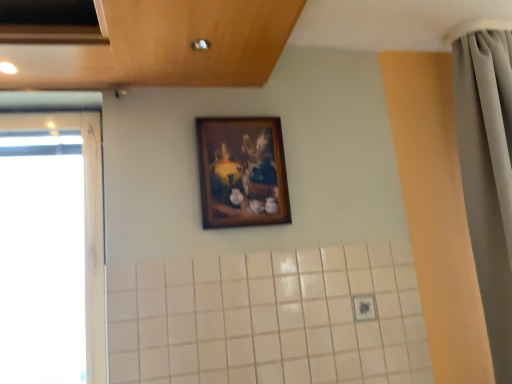
Question: Should I look upward or downward to see wooden frame at upper center?

Choices:
 (A) down
 (B) up

Answer: (B)

Question: From a real-world perspective, is wooden frame at upper center on top of gray fabric shower curtain at right?

Choices:
 (A) yes
 (B) no

Answer: (A)

Question: Are wooden frame at upper center and gray fabric shower curtain at right making contact?

Choices:
 (A) no
 (B) yes

Answer: (A)

Question: Is wooden frame at upper center bigger than gray fabric shower curtain at right?

Choices:
 (A) yes
 (B) no

Answer: (B)

Question: Is gray fabric shower curtain at right located within wooden frame at upper center?

Choices:
 (A) no
 (B) yes

Answer: (A)

Question: Does wooden frame at upper center have a greater width compared to gray fabric shower curtain at right?

Choices:
 (A) yes
 (B) no

Answer: (B)

Question: From a real-world perspective, is wooden frame at upper center physically below gray fabric shower curtain at right?

Choices:
 (A) no
 (B) yes

Answer: (A)

Question: Is the position of gray fabric shower curtain at right more distant than that of wooden frame at upper center?

Choices:
 (A) yes
 (B) no

Answer: (B)

Question: Could you tell me if gray fabric shower curtain at right is turned towards wooden frame at upper center?

Choices:
 (A) yes
 (B) no

Answer: (B)

Question: Is gray fabric shower curtain at right not near wooden frame at upper center?

Choices:
 (A) yes
 (B) no

Answer: (B)

Question: Does gray fabric shower curtain at right have a larger size compared to wooden frame at upper center?

Choices:
 (A) no
 (B) yes

Answer: (B)

Question: Considering the relative sizes of gray fabric shower curtain at right and wooden frame at upper center in the image provided, is gray fabric shower curtain at right wider than wooden frame at upper center?

Choices:
 (A) yes
 (B) no

Answer: (A)

Question: Can you confirm if gray fabric shower curtain at right is positioned to the left of wooden frame at upper center?

Choices:
 (A) no
 (B) yes

Answer: (A)

Question: Is transparent glass window at left outside of wooden frame at upper center?

Choices:
 (A) no
 (B) yes

Answer: (B)